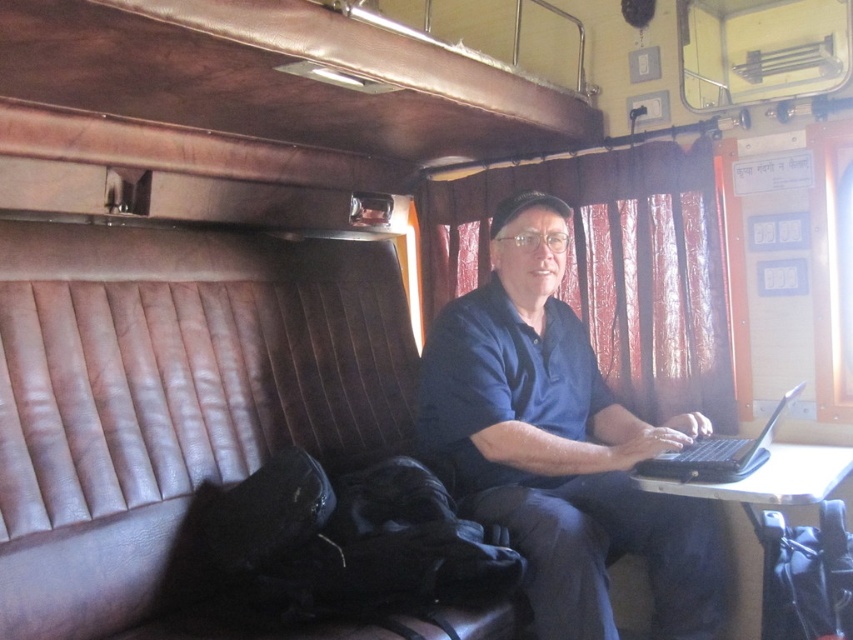
You are a passenger in the train compartment and want to sit down. You see the brown leather couch at center and the blue fabric shirt at center. Which one is closer to you?

The brown leather couch at center is closer to you than the blue fabric shirt at center.

You are a cleaning robot with a width of 20 inches. You are in the train compartment and need to move from the brown leather couch at center to the blue fabric shirt at center. Can you fit through the space between them?

The distance between the brown leather couch at center and the blue fabric shirt at center is 22.23 inches, which is wider than the robot width of 20 inches. Therefore, the robot can fit through the space between them.

You are a passenger in the train compartment and want to place a rectangular box that is 15 cm wide on the foldable table between the blue fabric shirt at center and the black plastic laptop at center. Can the box fit on the table without overlapping either object?

The blue fabric shirt at center is wider than the black plastic laptop at center. Since the box is 15 cm wide, it can fit on the table as long as there is enough space between them. However, the exact placement depends on the distance between the two objects, which isn